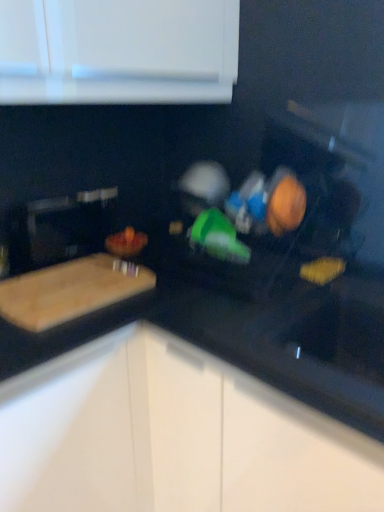
Question: From the image's perspective, is natural wood cutting board at left beneath black glossy countertop at center?

Choices:
 (A) yes
 (B) no

Answer: (B)

Question: Is natural wood cutting board at left at the right side of black glossy countertop at center?

Choices:
 (A) no
 (B) yes

Answer: (A)

Question: Does natural wood cutting board at left have a greater height compared to black glossy countertop at center?

Choices:
 (A) yes
 (B) no

Answer: (B)

Question: From a real-world perspective, is natural wood cutting board at left located higher than black glossy countertop at center?

Choices:
 (A) no
 (B) yes

Answer: (B)

Question: Would you say natural wood cutting board at left contains black glossy countertop at center?

Choices:
 (A) no
 (B) yes

Answer: (A)

Question: Would you say wooden bowl at center, acting as the 2th food starting from the left, is inside or outside yellow matte sponge at lower right, placed as the 2th food when sorted from back to front?

Choices:
 (A) inside
 (B) outside

Answer: (B)

Question: In the image, is wooden bowl at center, placed as the 1th food when sorted from front to back, on the left side or the right side of yellow matte sponge at lower right, placed as the 2th food when sorted from back to front?

Choices:
 (A) right
 (B) left

Answer: (B)

Question: Considering the positions of wooden bowl at center, the second food positioned from the right, and yellow matte sponge at lower right, which is the second food in front-to-back order, in the image, is wooden bowl at center, the second food positioned from the right, taller or shorter than yellow matte sponge at lower right, which is the second food in front-to-back order,?

Choices:
 (A) short
 (B) tall

Answer: (B)

Question: Is wooden bowl at center, acting as the 2th food starting from the left, bigger or smaller than yellow matte sponge at lower right, placed as the 2th food when sorted from back to front?

Choices:
 (A) small
 (B) big

Answer: (B)

Question: In terms of size, does natural wood cutting board at left appear bigger or smaller than black glossy countertop at center?

Choices:
 (A) big
 (B) small

Answer: (B)

Question: From a real-world perspective, is natural wood cutting board at left physically located above or below black glossy countertop at center?

Choices:
 (A) above
 (B) below

Answer: (A)

Question: Considering the relative positions of natural wood cutting board at left and black glossy countertop at center in the image provided, is natural wood cutting board at left to the left or to the right of black glossy countertop at center?

Choices:
 (A) right
 (B) left

Answer: (B)

Question: Is natural wood cutting board at left inside or outside of black glossy countertop at center?

Choices:
 (A) inside
 (B) outside

Answer: (B)

Question: Is point (331, 280) closer or farther from the camera than point (18, 337)?

Choices:
 (A) farther
 (B) closer

Answer: (A)

Question: Considering the relative positions of yellow matte sponge at lower right, which is the second food in front-to-back order, and black glossy countertop at center in the image provided, is yellow matte sponge at lower right, which is the second food in front-to-back order, to the left or to the right of black glossy countertop at center?

Choices:
 (A) right
 (B) left

Answer: (A)